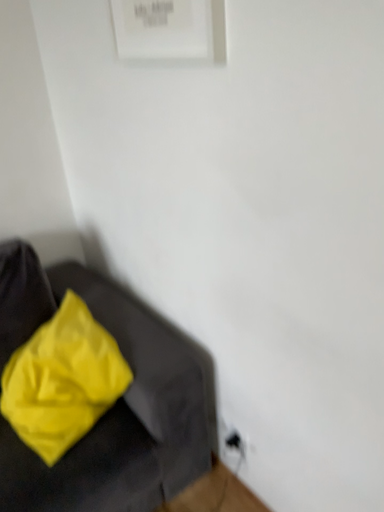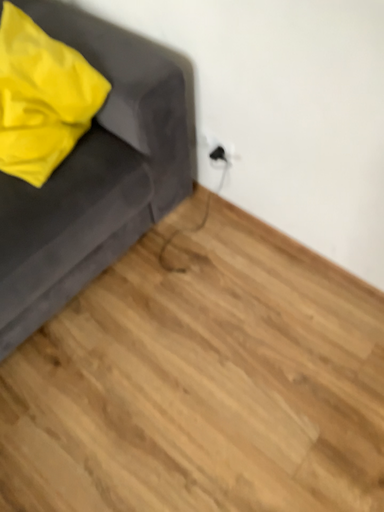
Question: How did the camera likely rotate when shooting the video?

Choices:
 (A) rotated upward
 (B) rotated downward

Answer: (B)